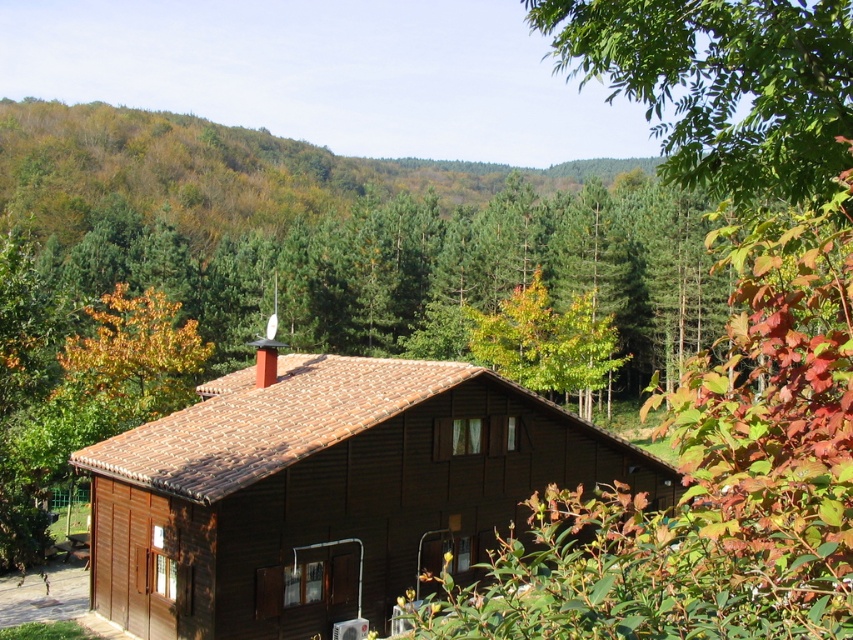
You are standing at the point closest to the house. Which point, point (305,358) or point (143,390), is closer to you?

Point (143,390) is closer to you because it is behind point (305,358), making it nearer to your position at the closest point to the house.